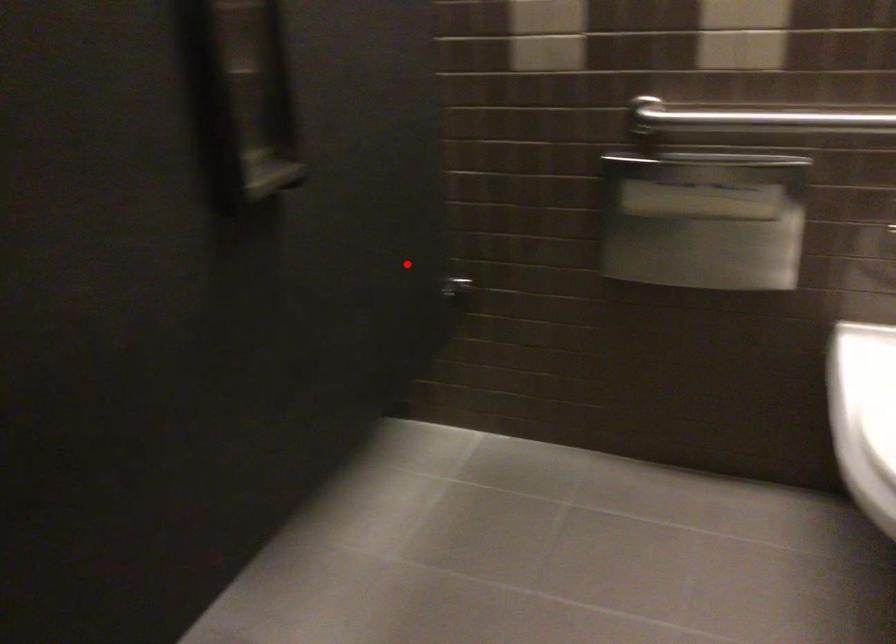
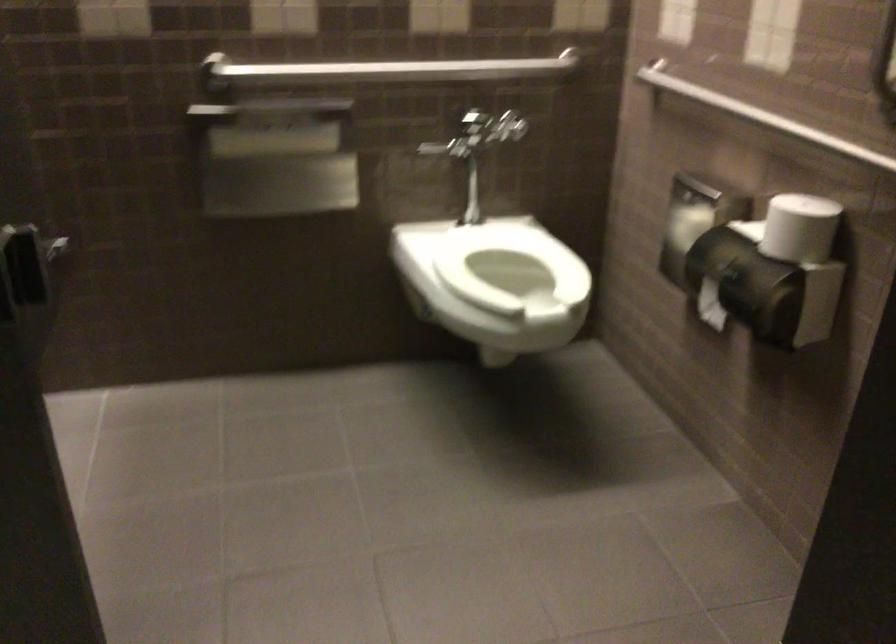
Find the pixel in the second image that matches the highlighted location in the first image.

(26, 223)